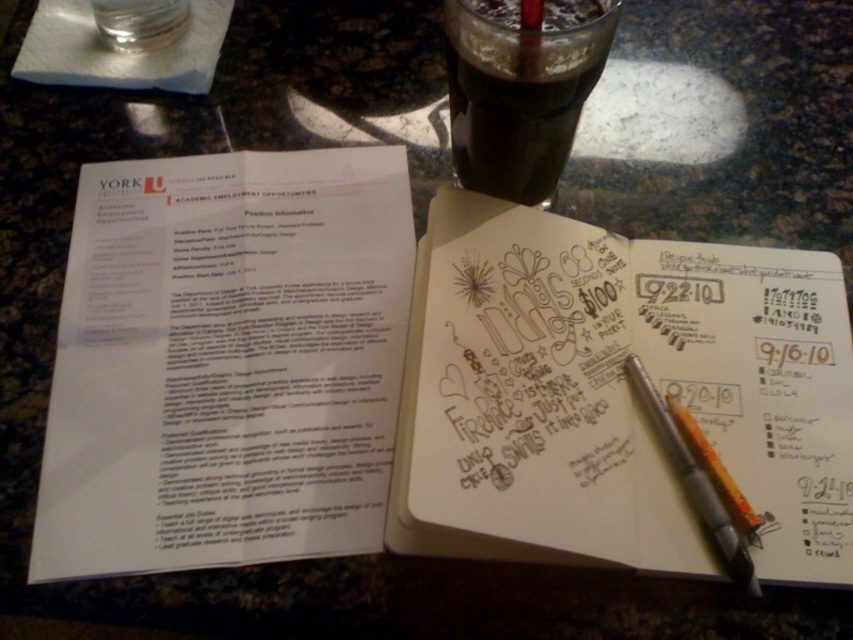
Question: Which object is farther from the camera taking this photo?

Choices:
 (A) dark brown liquid at upper center
 (B) brown paper notebook at center
 (C) silver metallic pen at center

Answer: (A)

Question: Which is farther from the brown paper notebook at center?

Choices:
 (A) silver metallic pen at center
 (B) dark brown liquid at upper center

Answer: (B)

Question: Does white paper at upper left have a lesser width compared to dark brown liquid at upper center?

Choices:
 (A) no
 (B) yes

Answer: (A)

Question: Does white paper at upper left appear over silver metallic pen at center?

Choices:
 (A) yes
 (B) no

Answer: (A)

Question: Which of the following is the closest to the observer?

Choices:
 (A) (236, 368)
 (B) (498, 147)
 (C) (486, 314)

Answer: (C)

Question: Does brown paper notebook at center come in front of silver metallic pen at center?

Choices:
 (A) no
 (B) yes

Answer: (B)